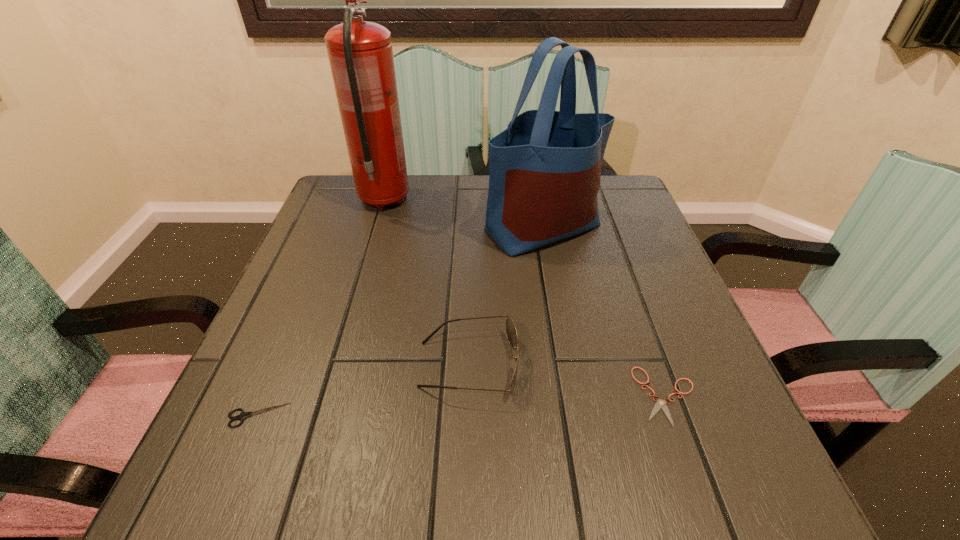
You are a GUI agent. You are given a task and a screenshot of the screen. Output one action in this format:
    pyautogui.click(x=<x>, y=<y>)
    Task: Click on the free space at the left edge
    The height and width of the screenshot is (540, 960).
    Given the screenshot: What is the action you would take?
    pyautogui.click(x=309, y=260)

At what (x,y) coordinates should I click in order to perform the action: click on vacant space at the right edge of the desktop. Please return your answer as a coordinate pair (x, y). Looking at the image, I should click on (672, 355).

In order to click on free space at the far left corner in this screenshot , I will do `click(369, 214)`.

At what (x,y) coordinates should I click in order to perform the action: click on free spot at the near left corner of the desktop. Please return your answer as a coordinate pair (x, y). The height and width of the screenshot is (540, 960). Looking at the image, I should click on (196, 501).

Locate an element on the screen. The image size is (960, 540). vacant space at the far right corner is located at coordinates (636, 211).

In the image, there is a desktop. At what (x,y) coordinates should I click in order to perform the action: click on vacant space at the near right corner. Please return your answer as a coordinate pair (x, y). This screenshot has height=540, width=960. Looking at the image, I should click on (718, 469).

Locate an element on the screen. This screenshot has width=960, height=540. free space between the tallest object and the shortest object is located at coordinates (526, 298).

In order to click on vacant space that is in between the shorter shears and the sunglasses in this screenshot , I will do `click(568, 381)`.

Locate an element on the screen. unoccupied position between the handbag and the fire extinguisher is located at coordinates (464, 214).

The width and height of the screenshot is (960, 540). Identify the location of free space between the right shears and the left shears. (463, 406).